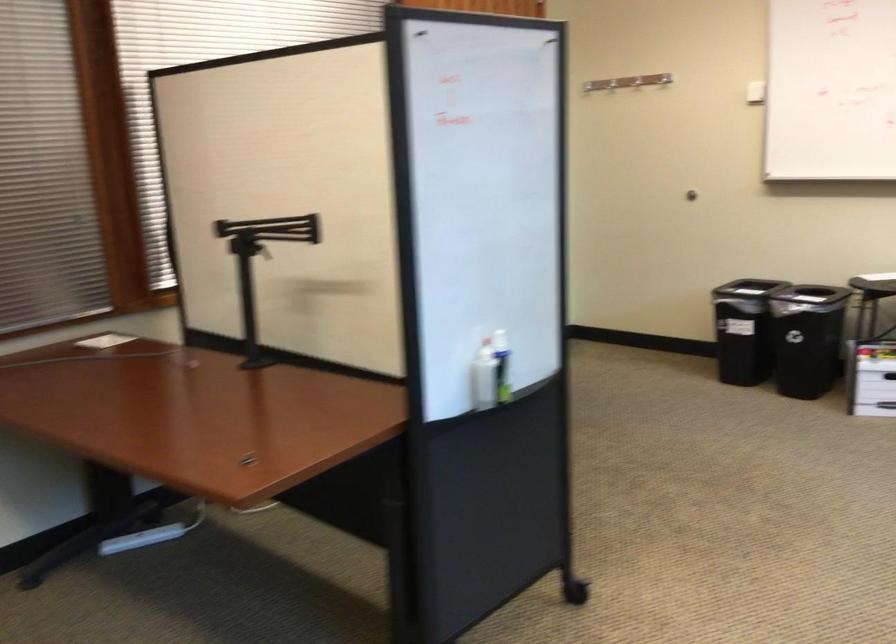
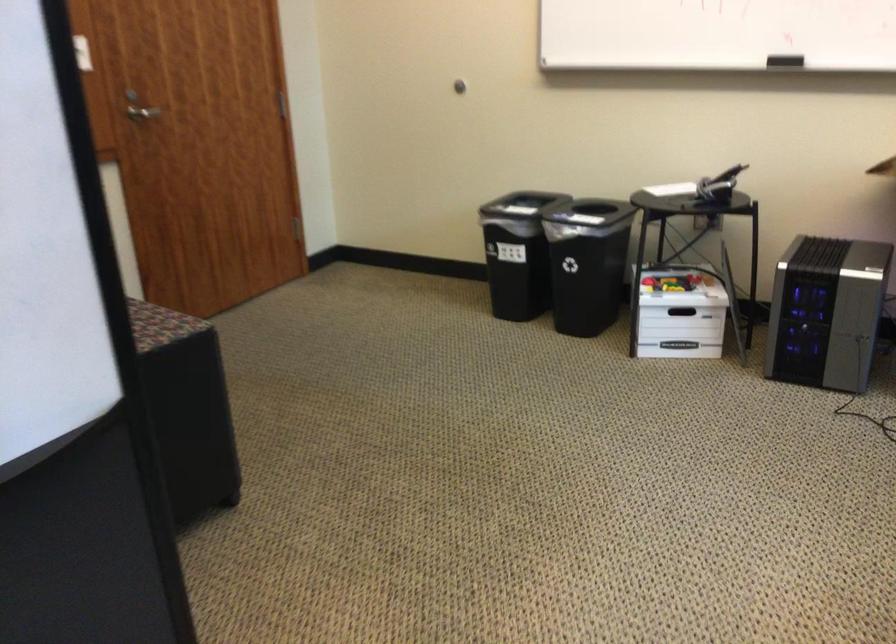
What movement of the cameraman would produce the second image?

The cameraman moved toward right, forward.